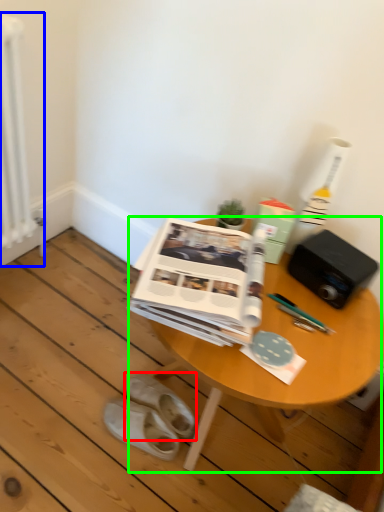
Question: Considering the real-world distances, which object is closest to footwear (highlighted by a red box)? radiator (highlighted by a blue box) or table (highlighted by a green box).

Choices:
 (A) radiator
 (B) table

Answer: (B)